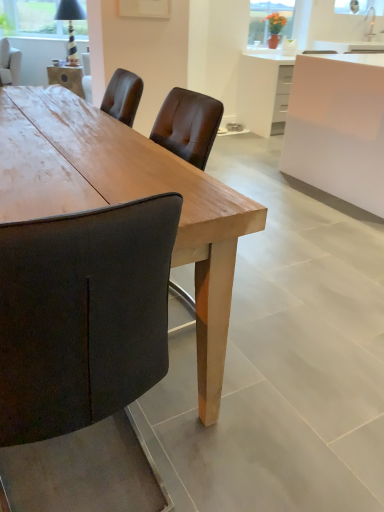
Question: From a real-world perspective, is white glossy cabinet at upper right above or below white glossy cabinet at upper right?

Choices:
 (A) below
 (B) above

Answer: (A)

Question: Visually, is white glossy cabinet at upper right positioned to the left or to the right of white glossy cabinet at upper right?

Choices:
 (A) left
 (B) right

Answer: (A)

Question: Estimate the real-world distances between objects in this image. Which object is closer to the dark brown leather chair at upper left?

Choices:
 (A) matte glass vase at upper center
 (B) white glossy cabinet at upper right
 (C) wooden table at center
 (D) white glossy cabinet at upper right

Answer: (B)

Question: Which of these objects is positioned farthest from the white glossy cabinet at upper right?

Choices:
 (A) dark brown leather chair at upper left
 (B) wooden table at center
 (C) white glossy cabinet at upper right
 (D) matte glass vase at upper center

Answer: (A)